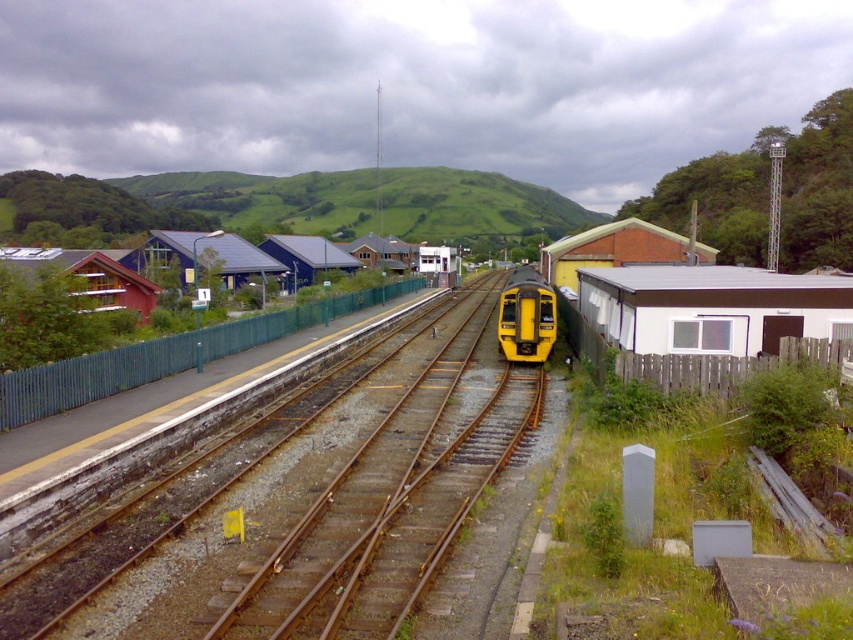
Question: Does metal tracks at center appear over yellow matte train at center?

Choices:
 (A) yes
 (B) no

Answer: (B)

Question: Which of the following is the closest to the observer?

Choices:
 (A) yellow matte train at center
 (B) metal tracks at center

Answer: (B)

Question: Among these points, which one is nearest to the camera?

Choices:
 (A) (207, 605)
 (B) (515, 301)

Answer: (A)

Question: Does metal tracks at center appear on the left side of yellow matte train at center?

Choices:
 (A) no
 (B) yes

Answer: (B)

Question: Does metal tracks at center have a greater width compared to yellow matte train at center?

Choices:
 (A) yes
 (B) no

Answer: (A)